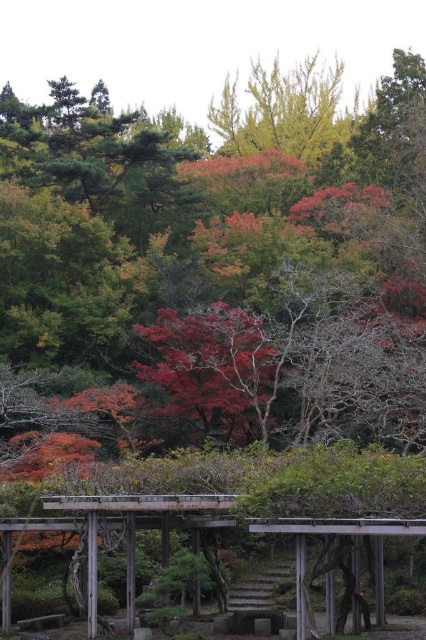
Question: Is shiny red maple at center positioned in front of yellow-green leafy tree at upper center?

Choices:
 (A) no
 (B) yes

Answer: (B)

Question: In this image, where is shiny red maple at center located relative to yellow-green leafy tree at upper center?

Choices:
 (A) below
 (B) above

Answer: (A)

Question: Which of the following is the farthest from the observer?

Choices:
 (A) yellow-green leafy tree at upper center
 (B) shiny red maple at center

Answer: (A)

Question: Is shiny red maple at center in front of yellow-green leafy tree at upper center?

Choices:
 (A) no
 (B) yes

Answer: (B)

Question: Which of the following is the farthest from the observer?

Choices:
 (A) shiny red maple at center
 (B) yellow-green leafy tree at upper center

Answer: (B)

Question: Which point is farther from the camera taking this photo?

Choices:
 (A) (157, 365)
 (B) (339, 116)

Answer: (B)